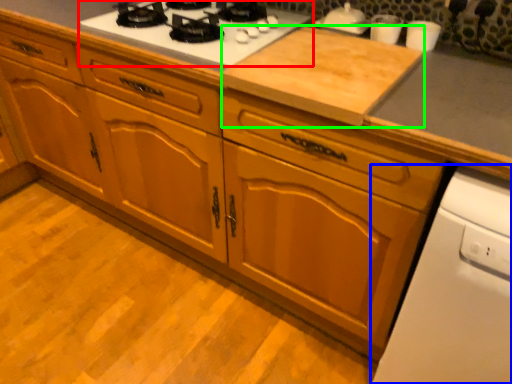
Question: Which is nearer to the gas stove (highlighted by a red box)? home appliance (highlighted by a blue box) or plywood (highlighted by a green box).

Choices:
 (A) home appliance
 (B) plywood

Answer: (B)